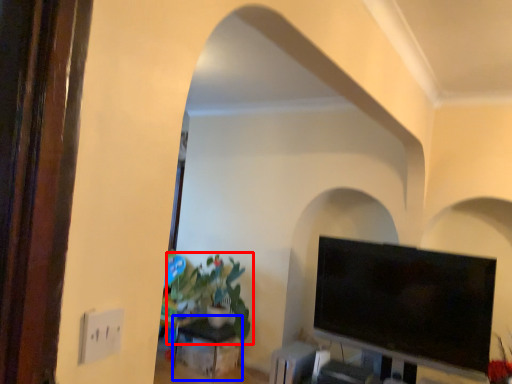
Question: Which of the following is the closest to the observer, houseplant (highlighted by a red box) or table (highlighted by a blue box)?

Choices:
 (A) houseplant
 (B) table

Answer: (A)